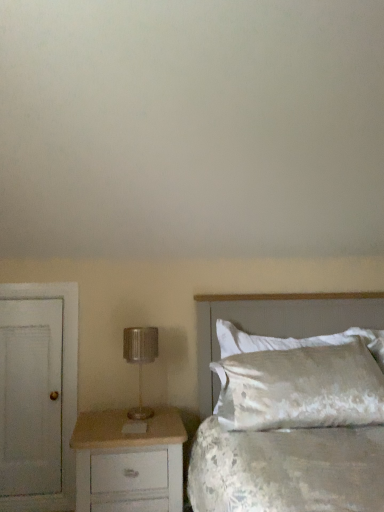
Identify the location of white matte door at left. This screenshot has height=512, width=384. (41, 390).

Find the location of `satin white pillow at right`. satin white pillow at right is located at coordinates (301, 388).

Where is `white painted wood chest of drawers at lower left`? The image size is (384, 512). white painted wood chest of drawers at lower left is located at coordinates (129, 462).

The image size is (384, 512). Describe the element at coordinates (129, 462) in the screenshot. I see `white painted wood chest of drawers at lower left` at that location.

Where is `white matte door at left`? This screenshot has width=384, height=512. white matte door at left is located at coordinates (41, 390).

From a real-world perspective, is white painted wood chest of drawers at lower left located higher than metallic silver lamp at left?

No.

Which object is positioned more to the right, white painted wood chest of drawers at lower left or metallic silver lamp at left?

Positioned to the right is metallic silver lamp at left.

Can you confirm if white painted wood chest of drawers at lower left is wider than metallic silver lamp at left?

Yes.

Considering the relative sizes of white painted wood chest of drawers at lower left and metallic silver lamp at left in the image provided, is white painted wood chest of drawers at lower left bigger than metallic silver lamp at left?

Yes, white painted wood chest of drawers at lower left is bigger than metallic silver lamp at left.

Is satin white pillow at right far away from satin white bed at right?

No, satin white pillow at right is not far from satin white bed at right.

What's the angular difference between satin white pillow at right and satin white bed at right's facing directions?

2.28 degrees separate the facing orientations of satin white pillow at right and satin white bed at right.

From a real-world perspective, is satin white pillow at right located higher than satin white bed at right?

Yes, from a real-world perspective, satin white pillow at right is over satin white bed at right

Is metallic silver lamp at left thinner than satin white bed at right?

Yes.

Which of these two, metallic silver lamp at left or satin white bed at right, is bigger?

satin white bed at right is bigger.

Between metallic silver lamp at left and satin white bed at right, which one has more height?

satin white bed at right is taller.

Does metallic silver lamp at left appear on the right side of satin white bed at right?

Incorrect, metallic silver lamp at left is not on the right side of satin white bed at right.

From the image's perspective, is metallic silver lamp at left above satin white pillow at right?

Yes, from the image's perspective, metallic silver lamp at left is on top of satin white pillow at right.

Does metallic silver lamp at left lie behind satin white pillow at right?

No, the depth of metallic silver lamp at left is less than that of satin white pillow at right.

In terms of size, does metallic silver lamp at left appear bigger or smaller than satin white pillow at right?

Considering their sizes, metallic silver lamp at left takes up less space than satin white pillow at right.

In the scene shown: How many degrees apart are the facing directions of satin white bed at right and white matte door at left?

The angle between the facing direction of satin white bed at right and the facing direction of white matte door at left is 0.0528 degrees.

Is white matte door at left surrounded by satin white bed at right?

That's incorrect, white matte door at left is not inside satin white bed at right.

Can you confirm if satin white bed at right is positioned to the left of white matte door at left?

Incorrect, satin white bed at right is not on the left side of white matte door at left.

Is metallic silver lamp at left positioned with its back to white matte door at left?

No, metallic silver lamp at left is not facing away from white matte door at left.

Is metallic silver lamp at left to the left or to the right of white matte door at left in the image?

From the image, it's evident that metallic silver lamp at left is to the right of white matte door at left.

Which of these two, metallic silver lamp at left or white matte door at left, stands shorter?

With less height is metallic silver lamp at left.

I want to click on lamp in front of the white matte door at left, so tap(140, 360).

How different are the orientations of white matte door at left and satin white bed at right in degrees?

0.0528 degrees.

Based on the photo, from a real-world perspective, is white matte door at left physically located above or below satin white bed at right?

In terms of real-world spatial position, white matte door at left is below satin white bed at right.

Consider the image. Is white matte door at left to the right of satin white bed at right from the viewer's perspective?

No.

The image size is (384, 512). What are the coordinates of `lamp above the white painted wood chest of drawers at lower left (from a real-world perspective)` in the screenshot? It's located at (140, 360).

Locate an element on the screen. The height and width of the screenshot is (512, 384). bed lying in front of the satin white pillow at right is located at coordinates (276, 322).

From the image, which object appears to be farther from satin white pillow at right, white painted wood chest of drawers at lower left or metallic silver lamp at left?

metallic silver lamp at left is positioned further to the anchor satin white pillow at right.

Estimate the real-world distances between objects in this image. Which object is further from satin white bed at right, white painted wood chest of drawers at lower left or white matte door at left?

white matte door at left.

Which object lies further to the anchor point satin white pillow at right, white matte door at left or white painted wood chest of drawers at lower left?

The object further to satin white pillow at right is white matte door at left.

Based on their spatial positions, is metallic silver lamp at left or white painted wood chest of drawers at lower left closer to satin white pillow at right?

white painted wood chest of drawers at lower left.

Looking at the image, which one is located closer to satin white bed at right, white matte door at left or satin white pillow at right?

satin white pillow at right is closer to satin white bed at right.

When comparing their distances from metallic silver lamp at left, does satin white bed at right or white painted wood chest of drawers at lower left seem closer?

white painted wood chest of drawers at lower left is positioned closer to the anchor metallic silver lamp at left.

Estimate the real-world distances between objects in this image. Which object is closer to white painted wood chest of drawers at lower left, satin white bed at right or white matte door at left?

Among the two, white matte door at left is located nearer to white painted wood chest of drawers at lower left.

Looking at the image, which one is located further to satin white pillow at right, satin white bed at right or white painted wood chest of drawers at lower left?

white painted wood chest of drawers at lower left is further to satin white pillow at right.

Find the location of a particular element. lamp between white matte door at left and satin white pillow at right is located at coordinates (140, 360).

The image size is (384, 512). What are the coordinates of `lamp between white matte door at left and satin white bed at right in the horizontal direction` in the screenshot? It's located at (140, 360).

You are a GUI agent. You are given a task and a screenshot of the screen. Output one action in this format:
    pyautogui.click(x=<x>, y=<y>)
    Task: Click on the lamp between white painted wood chest of drawers at lower left and satin white pillow at right from left to right
    
    Given the screenshot: What is the action you would take?
    pyautogui.click(x=140, y=360)

Locate an element on the screen. chest of drawers between white matte door at left and satin white pillow at right from left to right is located at coordinates (129, 462).